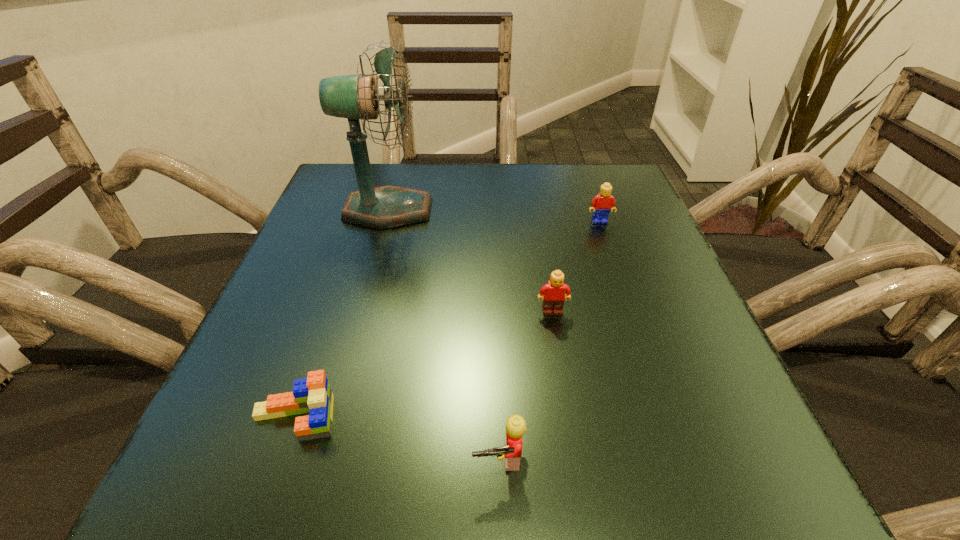
Locate an element on the screen. This screenshot has width=960, height=540. vacant space at the far edge of the desktop is located at coordinates (528, 190).

The image size is (960, 540). What are the coordinates of `vacant space at the near edge of the desktop` in the screenshot? It's located at (404, 466).

Image resolution: width=960 pixels, height=540 pixels. In order to click on free location at the left edge in this screenshot , I will do `click(231, 394)`.

This screenshot has width=960, height=540. Identify the location of vacant region at the right edge of the desktop. (621, 356).

At what (x,y) coordinates should I click in order to perform the action: click on vacant area at the far left corner. Please return your answer as a coordinate pair (x, y). The height and width of the screenshot is (540, 960). Looking at the image, I should click on (357, 183).

You are a GUI agent. You are given a task and a screenshot of the screen. Output one action in this format:
    pyautogui.click(x=<x>, y=<y>)
    Task: Click on the free space at the far right corner of the desktop
    This screenshot has width=960, height=540.
    Given the screenshot: What is the action you would take?
    pyautogui.click(x=625, y=210)

Find the location of a particular element. This screenshot has height=540, width=960. empty space that is in between the shortest Lego and the second Lego from left to right is located at coordinates (397, 438).

This screenshot has height=540, width=960. What are the coordinates of `vacant space that is in between the third object from left to right and the shortest Lego` in the screenshot? It's located at (397, 438).

In order to click on vacant point located between the fourth object from left to right and the third object from left to right in this screenshot , I will do `click(526, 385)`.

The width and height of the screenshot is (960, 540). In order to click on free space that is in between the fan and the shortest object in this screenshot , I will do `click(342, 314)`.